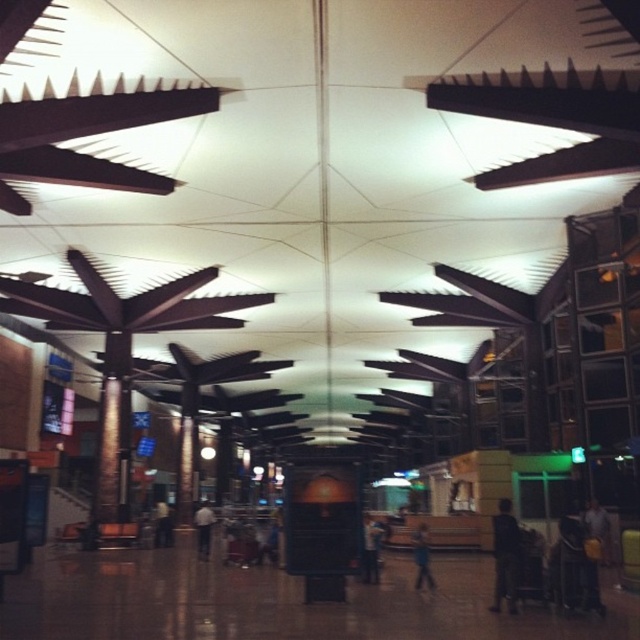
Question: Is dark gray fabric jacket at right bigger than dark blue jeans at center?

Choices:
 (A) yes
 (B) no

Answer: (B)

Question: Estimate the real-world distances between objects in this image. Which object is farther from the dark gray suit at center?

Choices:
 (A) dark fabric bag at center
 (B) dark brown leather jacket at center

Answer: (A)

Question: Is dark gray fabric jacket at right to the left of dark brown leather jacket at center from the viewer's perspective?

Choices:
 (A) no
 (B) yes

Answer: (A)

Question: Which point is closer to the camera taking this photo?

Choices:
 (A) [x=204, y=554]
 (B) [x=420, y=547]

Answer: (B)

Question: Which is nearer to the dark brown leather jacket at center?

Choices:
 (A) dark fabric bag at center
 (B) dark gray suit at center
 (C) dark blue jeans at center

Answer: (B)

Question: Can you confirm if dark gray fabric jacket at right is smaller than dark brown leather jacket at center?

Choices:
 (A) no
 (B) yes

Answer: (B)